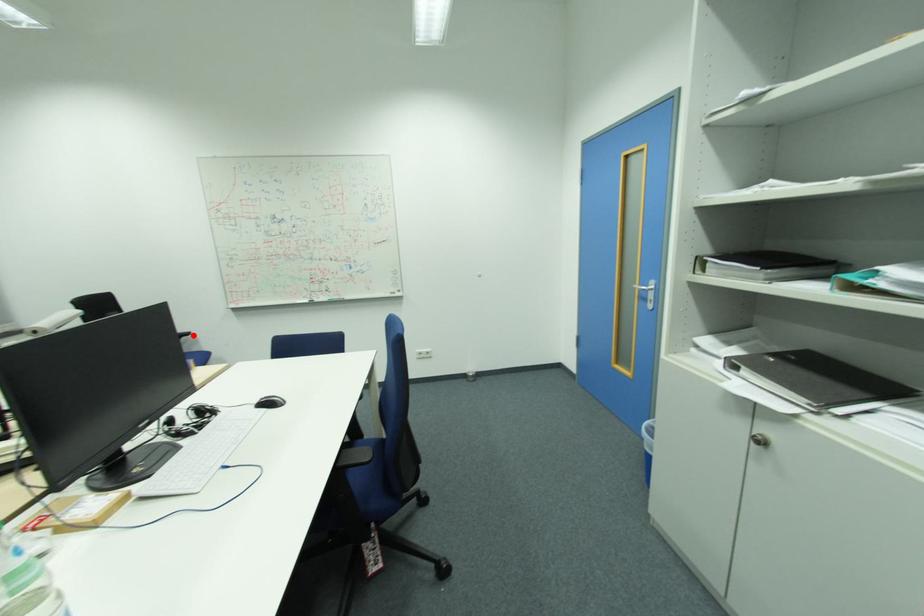
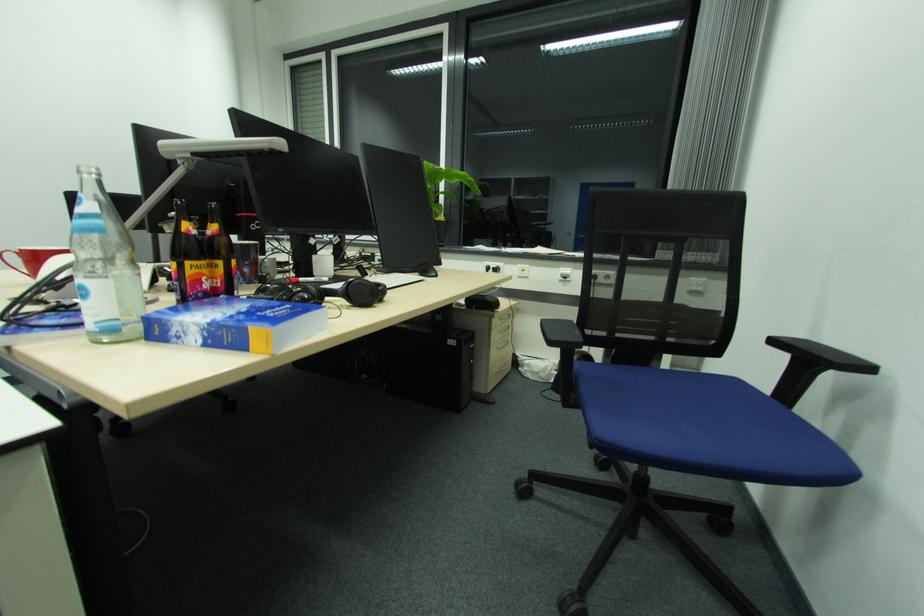
Locate, in the second image, the point that corresponds to the highlighted location in the first image.

(869, 369)